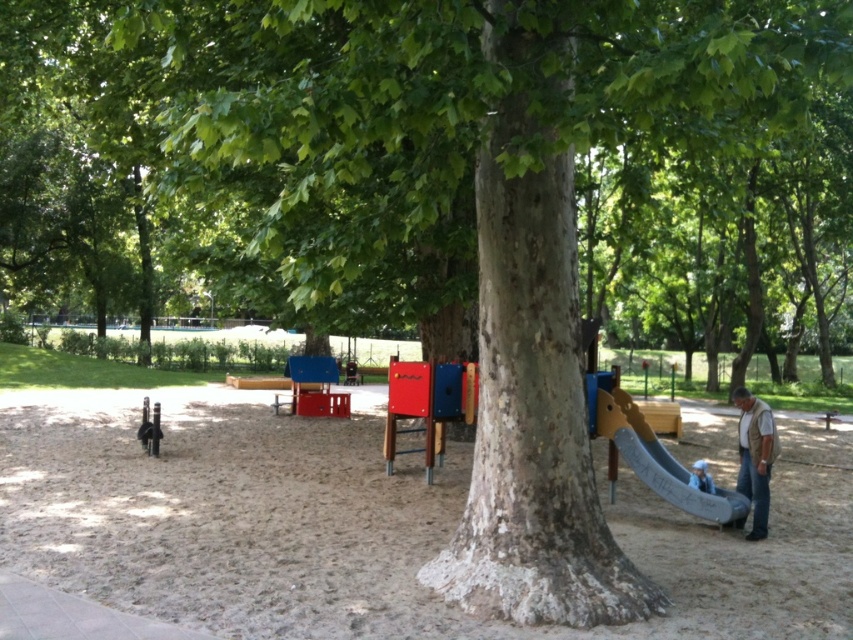
Is brown sandy playground at center positioned at the back of brown leather vest at lower right?

No, it is in front of brown leather vest at lower right.

Does brown sandy playground at center appear over brown leather vest at lower right?

No.

Which is behind, point (369, 579) or point (766, 468)?

The point (766, 468) is behind.

The height and width of the screenshot is (640, 853). Identify the location of brown sandy playground at center. (364, 524).

Between point (738, 428) and point (706, 481), which one is positioned in front?

Point (706, 481) is in front.

Identify the location of brown leather vest at lower right. (755, 456).

Does smooth gray slide at right come in front of brown leather vest at lower right?

No.

Between smooth gray slide at right and brown leather vest at lower right, which one appears on the left side from the viewer's perspective?

From the viewer's perspective, smooth gray slide at right appears more on the left side.

Who is more forward, (653, 451) or (752, 470)?

Positioned in front is point (752, 470).

Where is `smooth gray slide at right`? The image size is (853, 640). smooth gray slide at right is located at coordinates (659, 460).